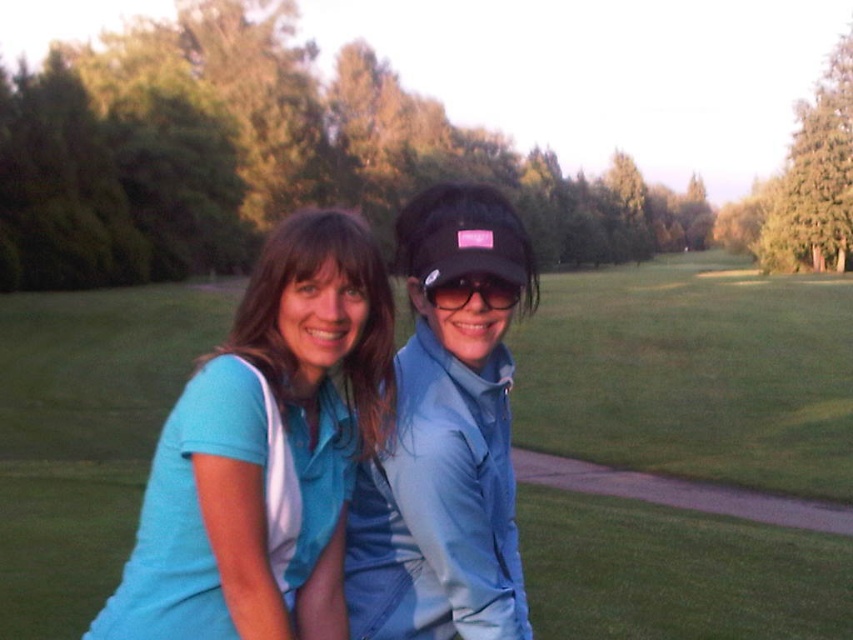
You are a photographer trying to capture a clear shot of both the matte blue jacket at center and the black matte sunglasses at center. Since you want both subjects to be in focus, you need to adjust your camera settings. Which object should you focus on first to ensure both are sharp?

You should focus on the matte blue jacket at center first because it is closer to the viewer than the black matte sunglasses at center, so adjusting focus starting from the closer object will help both be in sharp focus.

You are standing at the point marked by coordinates point (265, 451) in the image. Looking around, you see a matte blue shirt at center. Which direction should you face to see the person wearing the light blue polo shirt over a white undershirt?

The point (265, 451) marks the matte blue shirt at center, so facing forward from that point would allow you to see the matte blue shirt at center. The person wearing the light blue polo shirt over a white undershirt is likely the one on the left, so turning to your left would face you towards them.

You are standing at the position of the person on the left and want to throw a ball to the point closer to the camera between point (x=608, y=566) and point (x=180, y=572). Which point should you aim for?

You should aim for point (x=180, y=572) because it is closer to the camera than point (x=608, y=566).